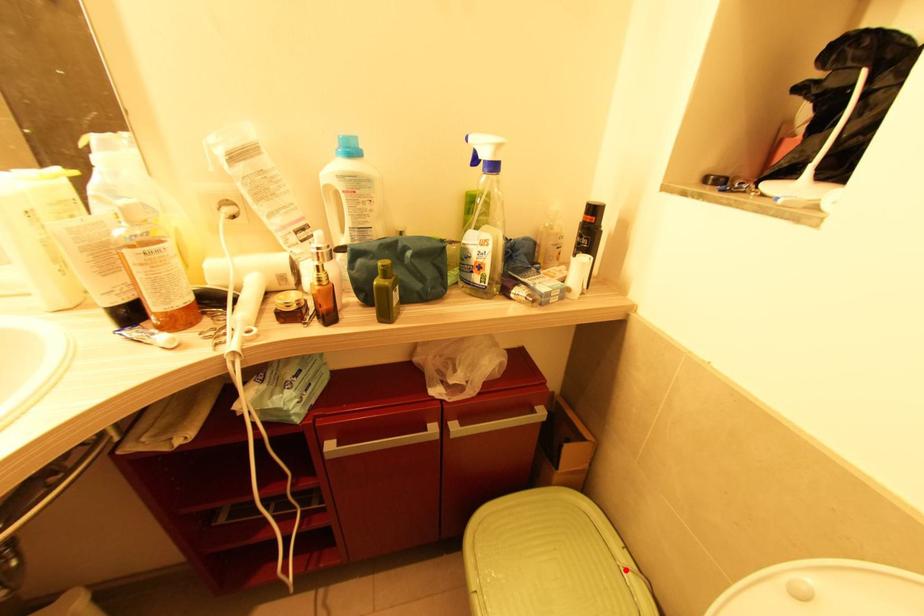
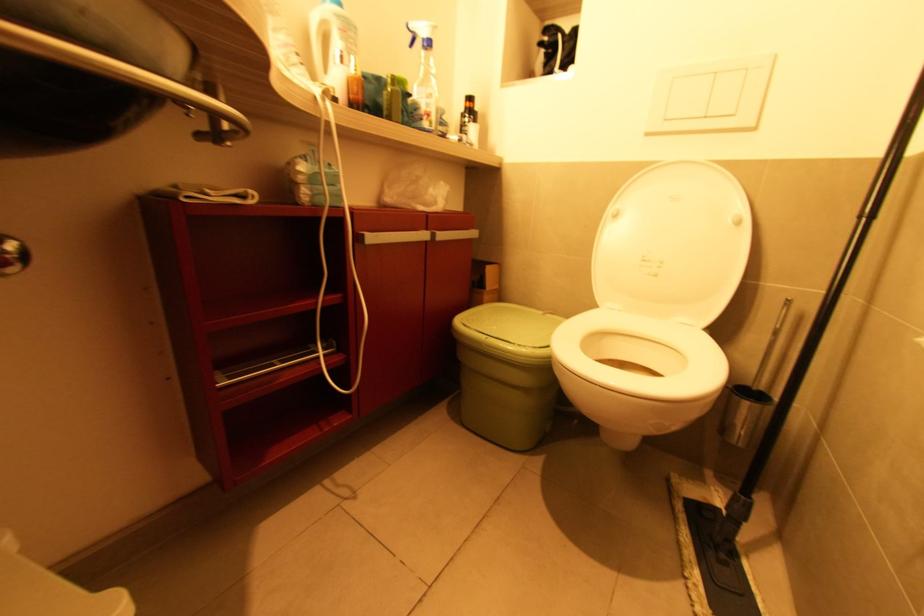
In the second image, find the point that corresponds to the highlighted location in the first image.

(545, 314)